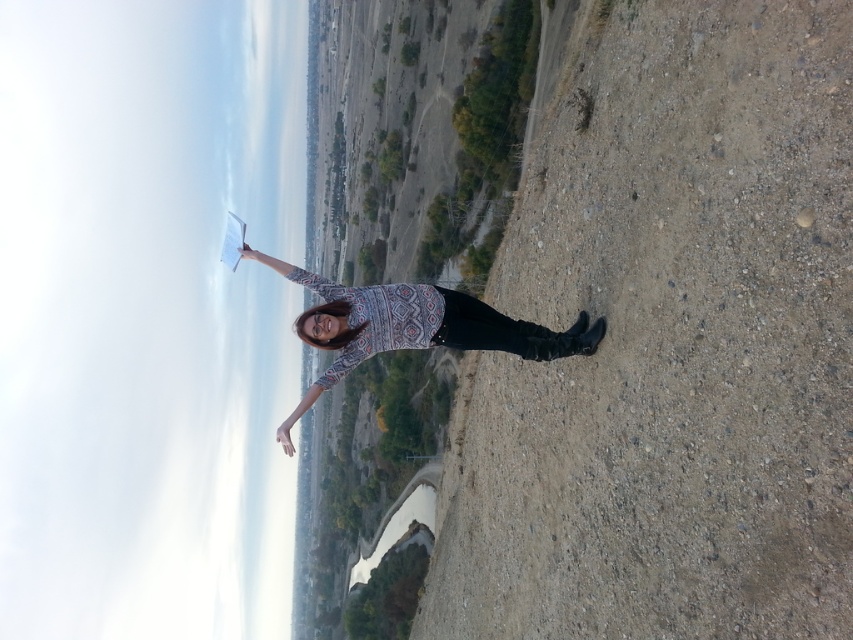
You are a hiker trying to determine the best spot to set up your tent. You notice the dirt ground at center and the patterned sweater at center in the image. Which surface would provide a wider area for your tent? Explain your reasoning based on the scene.

The dirt ground at center has a lesser width compared to the patterned sweater at center, so the patterned sweater at center would provide a wider area for setting up the tent.

You are a hiker who has just arrived at this scenic spot. You notice the dirt ground at center and the patterned sweater at center. Which object is positioned to the right of the other?

The dirt ground at center is to the right of the patterned sweater at center.

Based on the photo, you are a hiker trying to decide where to place your backpack. You see the dirt ground at center and the patterned sweater at center. Which surface is bigger and better suited for placing your backpack?

The dirt ground at center has a larger size compared to the patterned sweater at center, so it is better suited for placing your backpack.